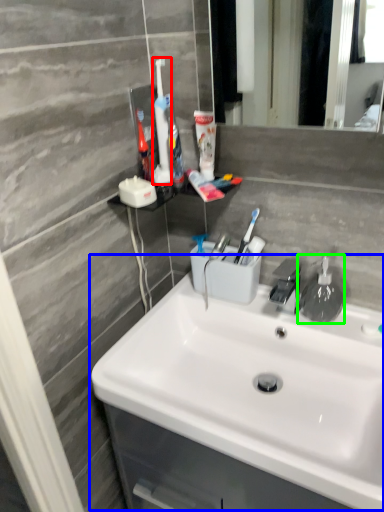
Question: Which object is positioned farthest from toothbrush (highlighted by a red box)? Select from sink (highlighted by a blue box) and soap dispenser (highlighted by a green box).

Choices:
 (A) sink
 (B) soap dispenser

Answer: (A)